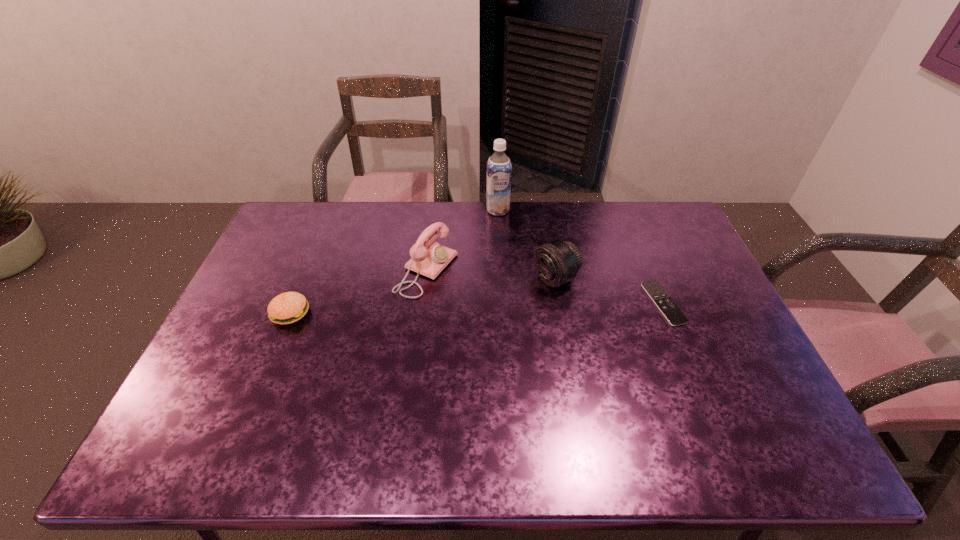
Find the location of a particular element. The height and width of the screenshot is (540, 960). vacant area located on the label of the soya milk is located at coordinates (508, 274).

Identify the location of free region located on the label of the soya milk. Image resolution: width=960 pixels, height=540 pixels. (507, 270).

You are a GUI agent. You are given a task and a screenshot of the screen. Output one action in this format:
    pyautogui.click(x=<x>, y=<y>)
    Task: Click on the free region located 0.150m on the label of the soya milk
    The image size is (960, 540).
    Given the screenshot: What is the action you would take?
    pyautogui.click(x=503, y=242)

The width and height of the screenshot is (960, 540). In order to click on free space located 0.080m on the front-facing side of the fourth object from left to right in this screenshot , I will do `click(516, 299)`.

Locate an element on the screen. This screenshot has width=960, height=540. vacant space located on the front-facing side of the fourth object from left to right is located at coordinates (464, 325).

Image resolution: width=960 pixels, height=540 pixels. I want to click on free space located 0.320m on the front-facing side of the fourth object from left to right, so click(x=448, y=333).

Identify the location of blank space located on the dial of the fourth object from right to left. point(469,291).

Identify the location of free space located on the dial of the fourth object from right to left. (469, 291).

Identify the location of vacant space situated on the dial of the fourth object from right to left. Image resolution: width=960 pixels, height=540 pixels. (561, 328).

I want to click on object that is at the far edge, so click(x=499, y=169).